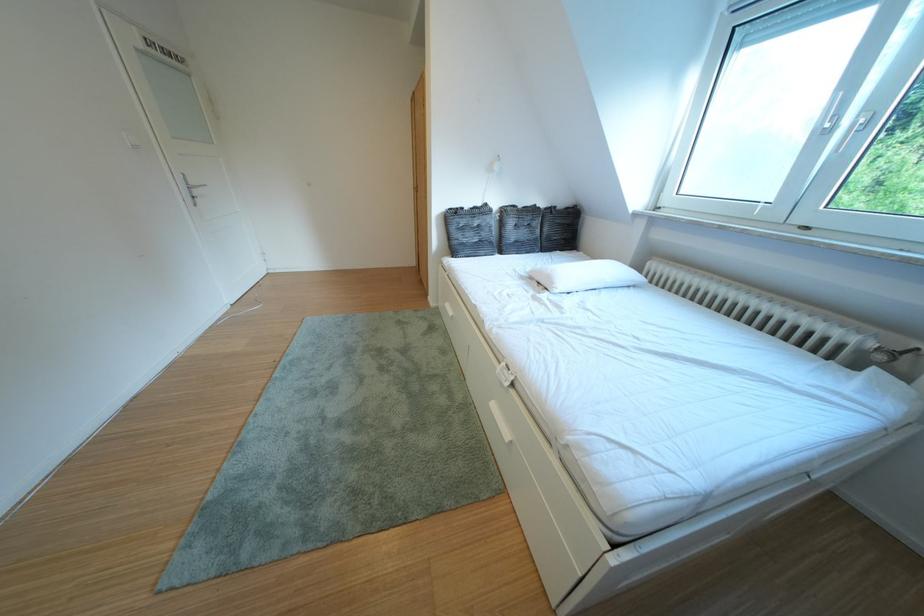
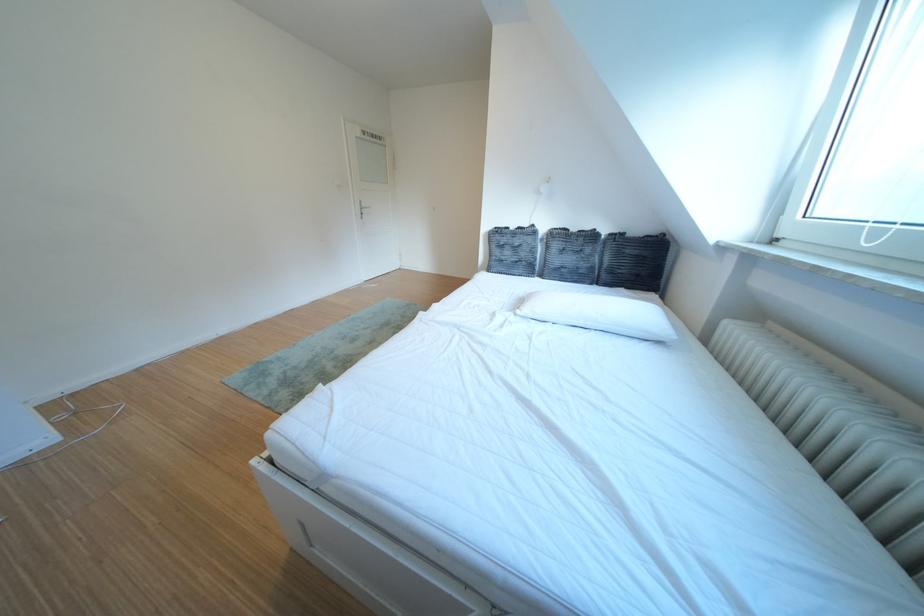
Locate, in the second image, the point that corresponds to point 574,291 in the first image.

(540, 314)